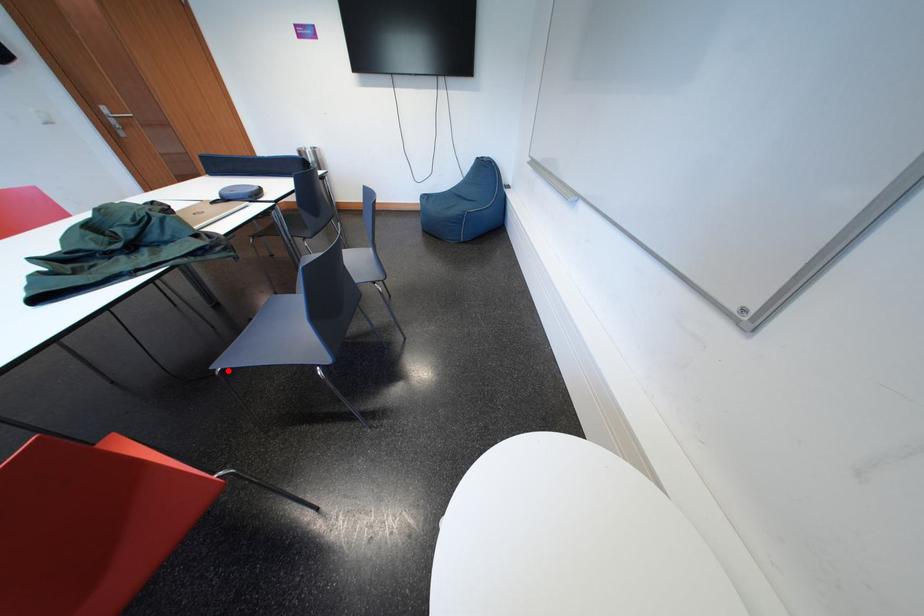
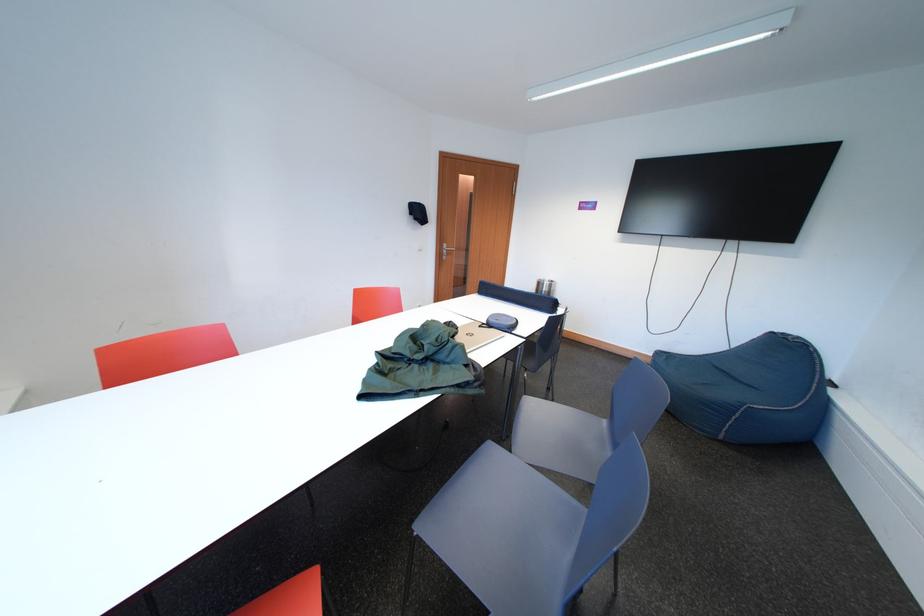
The point at the highlighted location is marked in the first image. Where is the corresponding point in the second image?

(429, 532)